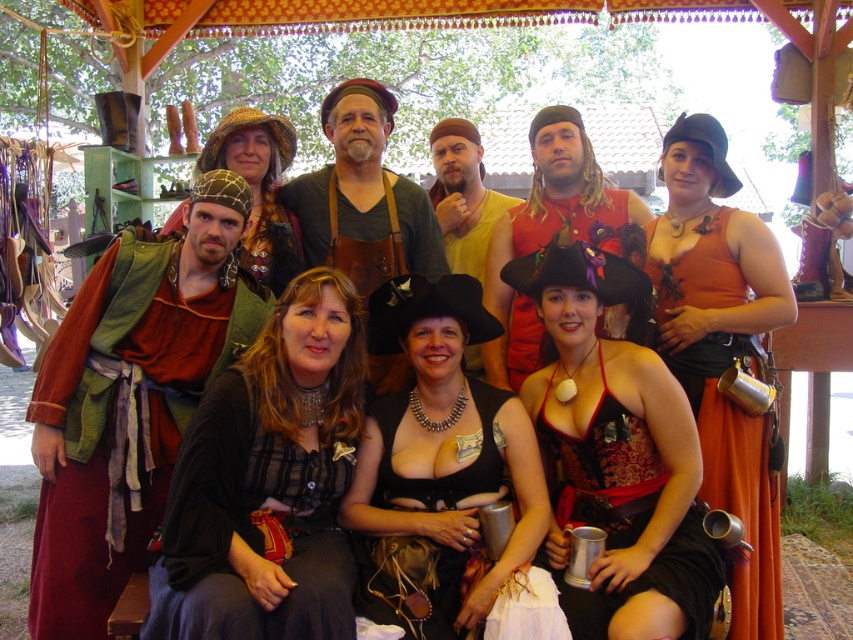
Consider the image. You are organizing a costume parade and need to know which costume is wider to decide the order. Which is wider, the matte black corset at center or the yellow cotton tunic at center?

The matte black corset at center is wider than the yellow cotton tunic at center according to the description.